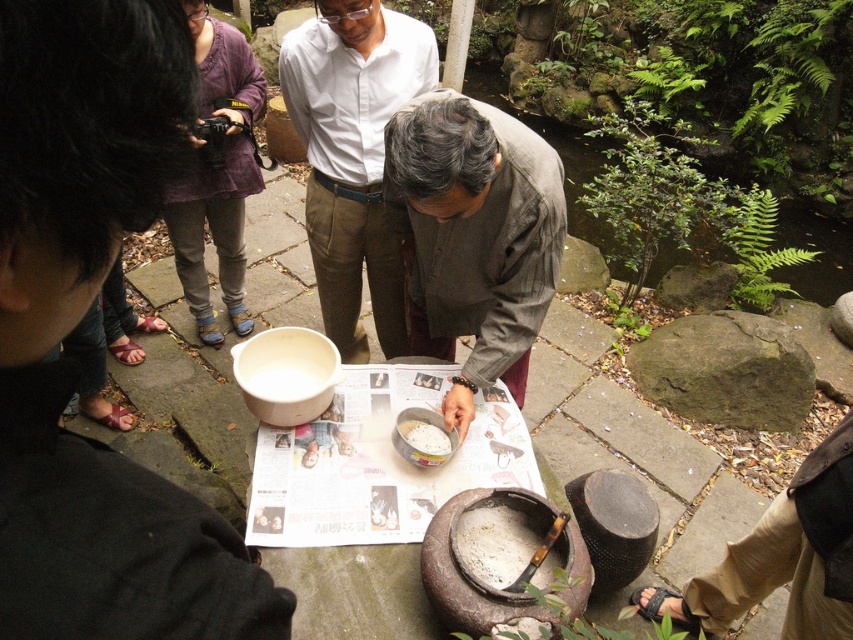
What is located at the coordinates point (352, 156) in the image?

The light brown cotton shirt at center is located at point (352, 156).

What is the object located at the coordinates point (373, 499) in the image?

The object located at point (373, 499) is the newspaper paper at center.

You are standing at the origin point of the scene and want to locate the light brown cotton shirt at center. What are the coordinates where you can find it?

The light brown cotton shirt at center is located at coordinates point (352, 156).